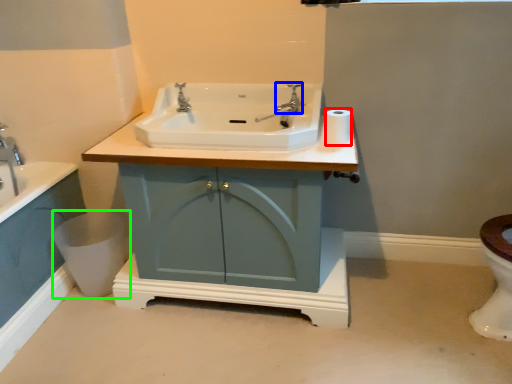
Question: Estimate the real-world distances between objects in this image. Which object is closer to toilet paper (highlighted by a red box), plumbing fixture (highlighted by a blue box) or toilet bowl (highlighted by a green box)?

Choices:
 (A) plumbing fixture
 (B) toilet bowl

Answer: (A)